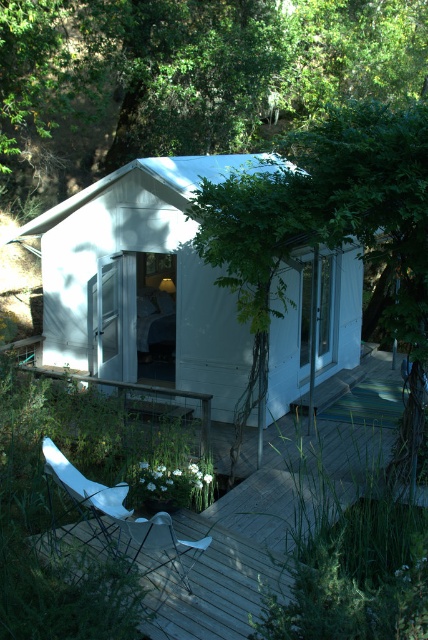
Can you confirm if white matte hut at center is thinner than wooden deck at center?

Correct, white matte hut at center's width is less than wooden deck at center's.

Which of these two, white matte hut at center or wooden deck at center, stands shorter?

wooden deck at center is shorter.

The image size is (428, 640). What do you see at coordinates (142, 282) in the screenshot? I see `white matte hut at center` at bounding box center [142, 282].

The width and height of the screenshot is (428, 640). In order to click on white matte hut at center in this screenshot , I will do `click(142, 282)`.

Does white matte hut at center have a lesser width compared to white plastic chair at lower left?

Indeed, white matte hut at center has a lesser width compared to white plastic chair at lower left.

Does white matte hut at center have a lesser height compared to white plastic chair at lower left?

Indeed, white matte hut at center has a lesser height compared to white plastic chair at lower left.

What do you see at coordinates (142, 282) in the screenshot? The height and width of the screenshot is (640, 428). I see `white matte hut at center` at bounding box center [142, 282].

I want to click on white matte hut at center, so click(x=142, y=282).

Who is more distant from viewer, [184,634] or [104,531]?

Point [104,531]

Who is more forward, (228, 545) or (139, 538)?

Point (139, 538)

Is point (354, 456) positioned after point (103, 540)?

Yes, point (354, 456) is farther from viewer.

You are a GUI agent. You are given a task and a screenshot of the screen. Output one action in this format:
    pyautogui.click(x=<x>, y=<y>)
    Task: Click on the wooden deck at center
    
    Given the screenshot: What is the action you would take?
    pyautogui.click(x=281, y=506)